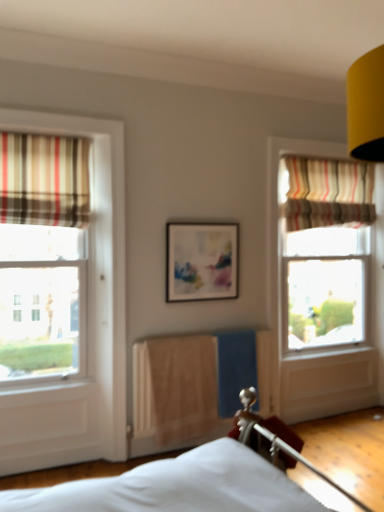
Locate an element on the screen. This screenshot has height=512, width=384. free space above matte plastic picture frame at center (from a real-world perspective) is located at coordinates (200, 222).